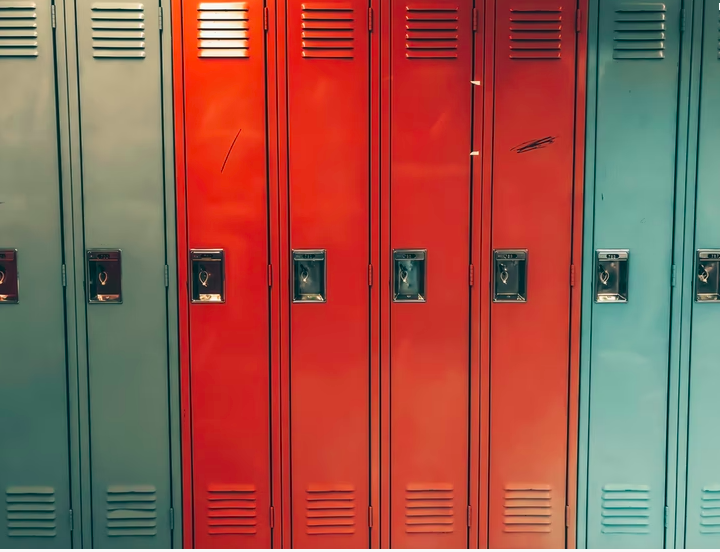
Image resolution: width=720 pixels, height=552 pixels. Identify the location of red lockers. (225, 147), (348, 152), (428, 140), (521, 125).